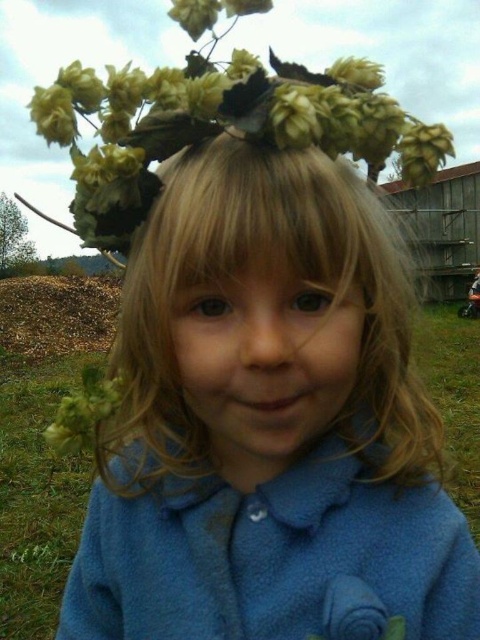
Does blue fleece jacket at center have a greater width compared to blue fleece sweatshirt at center?

Yes, blue fleece jacket at center is wider than blue fleece sweatshirt at center.

Which of these two, blue fleece jacket at center or blue fleece sweatshirt at center, stands shorter?

With less height is blue fleece sweatshirt at center.

What do you see at coordinates (267, 420) in the screenshot? I see `blue fleece jacket at center` at bounding box center [267, 420].

At what (x,y) coordinates should I click in order to perform the action: click on blue fleece jacket at center. Please return your answer as a coordinate pair (x, y). Image resolution: width=480 pixels, height=640 pixels. Looking at the image, I should click on (267, 420).

Can you confirm if blue fleece sweatshirt at center is shorter than green matte flower at upper center?

Yes, blue fleece sweatshirt at center is shorter than green matte flower at upper center.

Between blue fleece sweatshirt at center and green matte flower at upper center, which one is positioned lower?

Positioned lower is blue fleece sweatshirt at center.

Where is `blue fleece sweatshirt at center`? Image resolution: width=480 pixels, height=640 pixels. blue fleece sweatshirt at center is located at coordinates (274, 557).

You are a GUI agent. You are given a task and a screenshot of the screen. Output one action in this format:
    pyautogui.click(x=<x>, y=<y>)
    Task: Click on the blue fleece sweatshirt at center
    This screenshot has height=640, width=480.
    Given the screenshot: What is the action you would take?
    pyautogui.click(x=274, y=557)

Which is above, blue fleece head at center or green matte flower at upper center?

Positioned higher is green matte flower at upper center.

Can you confirm if blue fleece head at center is positioned above green matte flower at upper center?

No, blue fleece head at center is not above green matte flower at upper center.

Who is more distant from viewer, (201, 280) or (173, 77)?

The point (173, 77) is behind.

The image size is (480, 640). Find the location of `blue fleece head at center`. blue fleece head at center is located at coordinates (264, 269).